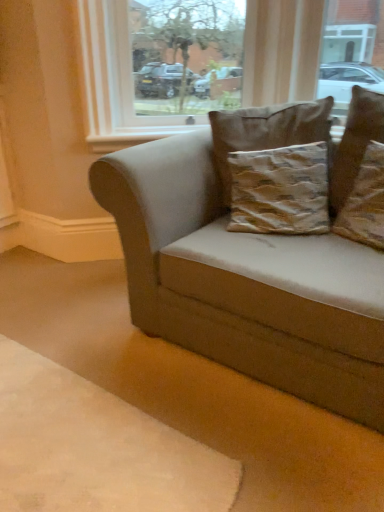
Question: Is textured brown pillow at upper right, which is the 2th pillow in right-to-left order, positioned behind transparent glass window at upper center?

Choices:
 (A) yes
 (B) no

Answer: (B)

Question: Does textured brown pillow at upper right, which is the 2th pillow in right-to-left order, have a lesser height compared to transparent glass window at upper center?

Choices:
 (A) yes
 (B) no

Answer: (A)

Question: Is textured brown pillow at upper right, which is the 2th pillow in right-to-left order, next to transparent glass window at upper center?

Choices:
 (A) yes
 (B) no

Answer: (B)

Question: Is textured brown pillow at upper right, which ranks as the 2th pillow in left-to-right order, thinner than transparent glass window at upper center?

Choices:
 (A) no
 (B) yes

Answer: (B)

Question: From the image's perspective, is textured brown pillow at upper right, which ranks as the 2th pillow in left-to-right order, located above transparent glass window at upper center?

Choices:
 (A) no
 (B) yes

Answer: (A)

Question: Looking at their shapes, would you say suede beige couch at center is wider or thinner than brown textured pillow at upper right, which is the third pillow from left to right?

Choices:
 (A) thin
 (B) wide

Answer: (B)

Question: Relative to brown textured pillow at upper right, which is the third pillow from left to right, is suede beige couch at center in front or behind?

Choices:
 (A) front
 (B) behind

Answer: (A)

Question: Is suede beige couch at center bigger or smaller than brown textured pillow at upper right, which ranks as the 1th pillow in right-to-left order?

Choices:
 (A) small
 (B) big

Answer: (B)

Question: Considering the relative positions of suede beige couch at center and brown textured pillow at upper right, which is the third pillow from left to right, in the image provided, is suede beige couch at center to the left or to the right of brown textured pillow at upper right, which is the third pillow from left to right,?

Choices:
 (A) right
 (B) left

Answer: (B)

Question: From a real-world perspective, is beige fabric dog bed at lower right physically located above or below brown textured pillow at upper right, which is the third pillow from left to right?

Choices:
 (A) above
 (B) below

Answer: (B)

Question: Is point (160, 466) closer or farther from the camera than point (367, 159)?

Choices:
 (A) farther
 (B) closer

Answer: (B)

Question: From the image's perspective, relative to brown textured pillow at upper right, which is the third pillow from left to right, is beige fabric dog bed at lower right above or below?

Choices:
 (A) below
 (B) above

Answer: (A)

Question: In the image, is beige fabric dog bed at lower right positioned in front of or behind brown textured pillow at upper right, which ranks as the 1th pillow in right-to-left order?

Choices:
 (A) front
 (B) behind

Answer: (A)

Question: Considering their positions, is suede beige couch at center located in front of or behind textured brown pillow at upper right, which ranks as the 2th pillow in left-to-right order?

Choices:
 (A) front
 (B) behind

Answer: (A)

Question: Based on their positions, is suede beige couch at center located to the left or right of textured brown pillow at upper right, which ranks as the 2th pillow in left-to-right order?

Choices:
 (A) right
 (B) left

Answer: (B)